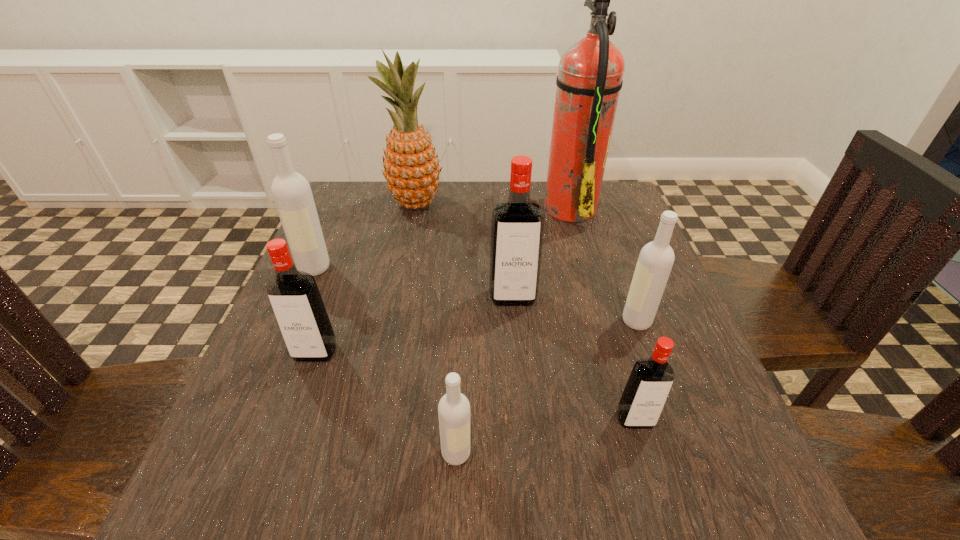
This screenshot has width=960, height=540. In order to click on the second smallest red vodka in this screenshot , I will do `click(294, 296)`.

Locate an element on the screen. This screenshot has height=540, width=960. the second nearest vodka is located at coordinates (649, 384).

The width and height of the screenshot is (960, 540). I want to click on the rightmost red vodka, so click(649, 384).

Identify the location of the second white vodka from right to left. (454, 408).

Where is `the third vodka from left to right`? Image resolution: width=960 pixels, height=540 pixels. the third vodka from left to right is located at coordinates (454, 408).

The height and width of the screenshot is (540, 960). Identify the location of free spot located 0.310m at the nozzle of the fire extinguisher. (423, 206).

This screenshot has height=540, width=960. Identify the location of vacant point located 0.150m at the nozzle of the fire extinguisher. (485, 206).

You are a GUI agent. You are given a task and a screenshot of the screen. Output one action in this format:
    pyautogui.click(x=<x>, y=<y>)
    Task: Click on the vacant space situated at the nozzle of the fire extinguisher
    Image resolution: width=960 pixels, height=540 pixels.
    Given the screenshot: What is the action you would take?
    pyautogui.click(x=519, y=206)

At what (x,y) coordinates should I click in order to perform the action: click on vacant space located on the front of the third object from left to right. Please return your answer as a coordinate pair (x, y). The width and height of the screenshot is (960, 540). Looking at the image, I should click on (392, 319).

Where is `vacant space located 0.100m on the front of the leftmost white vodka`? vacant space located 0.100m on the front of the leftmost white vodka is located at coordinates (295, 312).